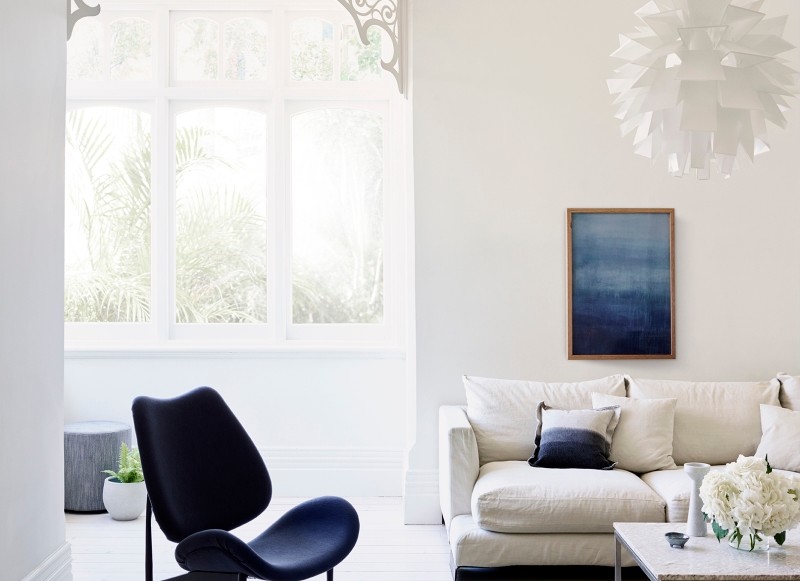
The width and height of the screenshot is (800, 581). Identify the location of window. (329, 268).